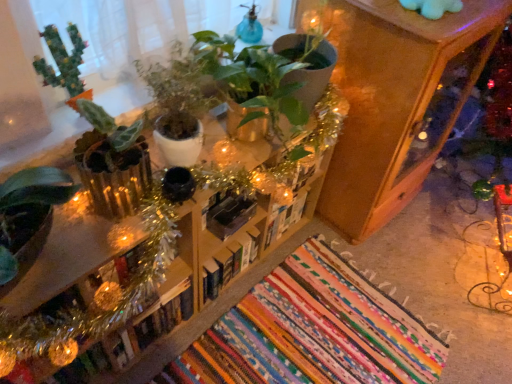
This screenshot has width=512, height=384. Find the location of `vacant space in front of wooden cabinet at upper right`. vacant space in front of wooden cabinet at upper right is located at coordinates (357, 282).